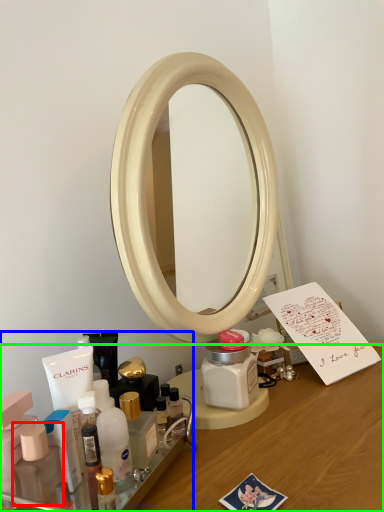
Question: Which object is the farthest from toiletry (highlighted by a red box)? Choose among these: toiletry (highlighted by a blue box) or desk (highlighted by a green box).

Choices:
 (A) toiletry
 (B) desk

Answer: (B)